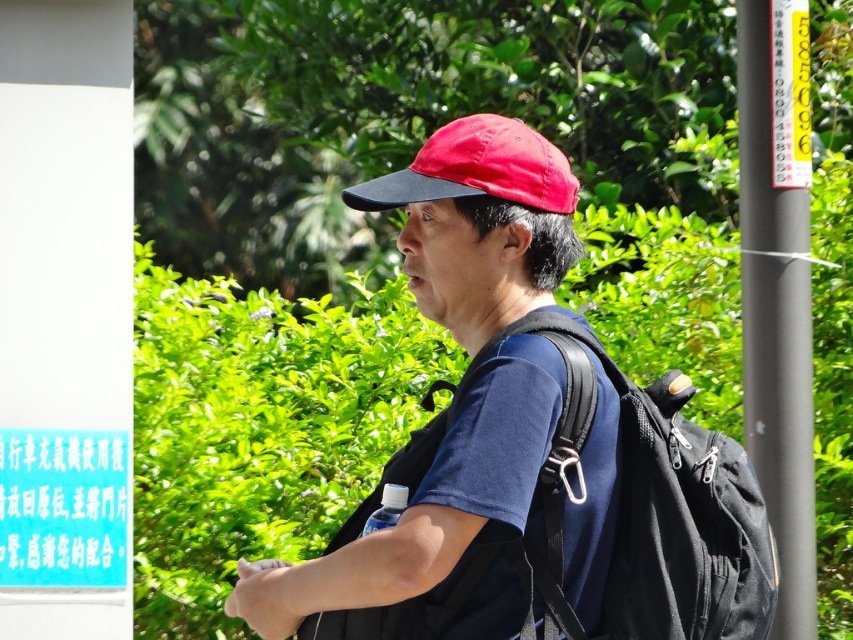
Based on the scene description, which object is taller when comparing the matte blue shirt at center and the black fabric backpack at center?

The matte blue shirt at center is much taller than the black fabric backpack at center.

You are a photographer trying to capture the person in the image. You want to ensure both the matte blue shirt at center and the black fabric backpack at center are clearly visible in your shot. Given that your camera has a minimum focus distance of 4 inches, will you be able to focus on both objects simultaneously?

The matte blue shirt at center and the black fabric backpack at center are 4.41 inches apart from each other. Since the distance between them is greater than the camera minimum focus distance of 4 inches, the camera can focus on both objects simultaneously.